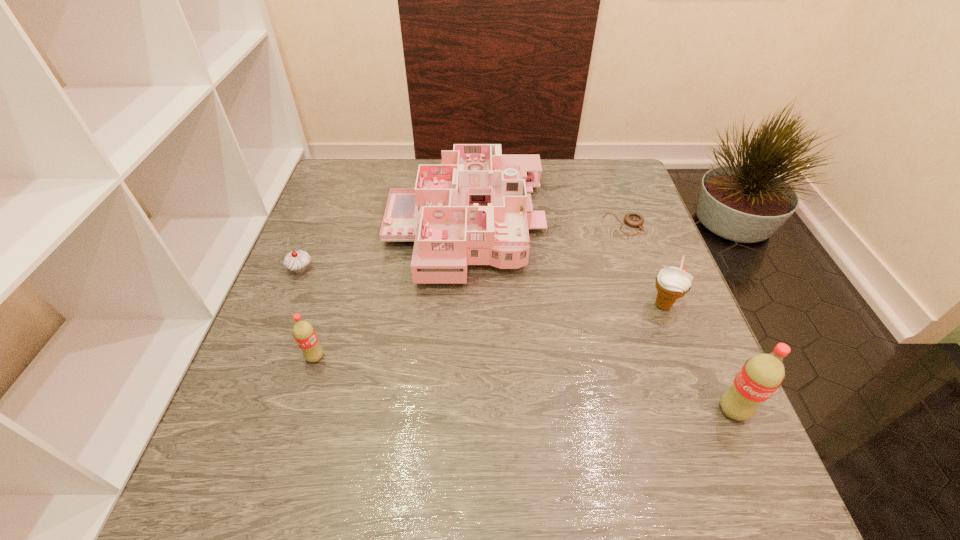
Where is `blank space that satisfies the following two spatial constraints: 1. at the front entrance of the nearer soda; 2. on the left side of the fourth object from right to left`? blank space that satisfies the following two spatial constraints: 1. at the front entrance of the nearer soda; 2. on the left side of the fourth object from right to left is located at coordinates (460, 410).

In order to click on free space in the image that satisfies the following two spatial constraints: 1. on the front side of the second nearest object; 2. on the left side of the taller soda in this screenshot , I will do `click(299, 410)`.